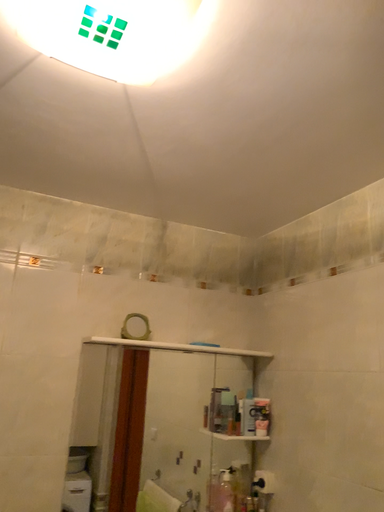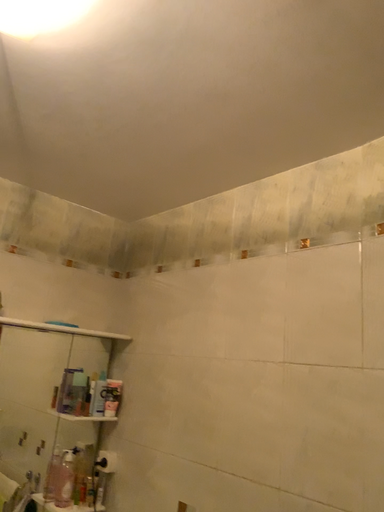
Question: Which way did the camera rotate in the video?

Choices:
 (A) rotated right
 (B) rotated left

Answer: (A)